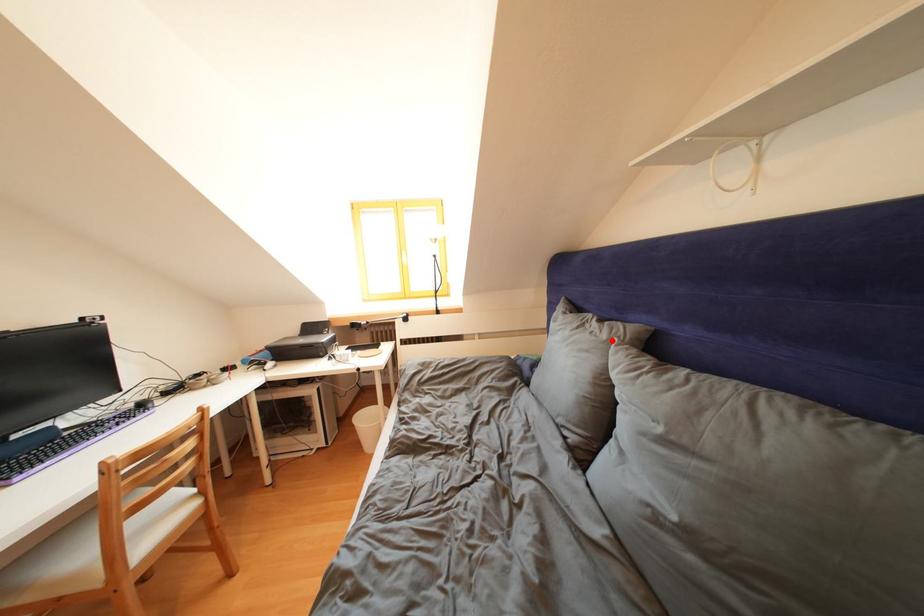
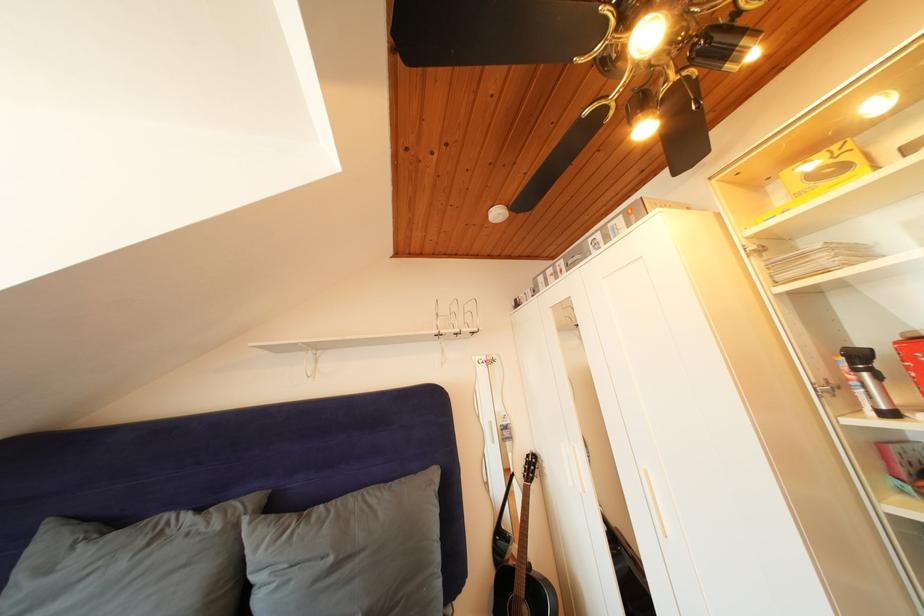
The point at the highlighted location is marked in the first image. Where is the corresponding point in the second image?

(225, 531)